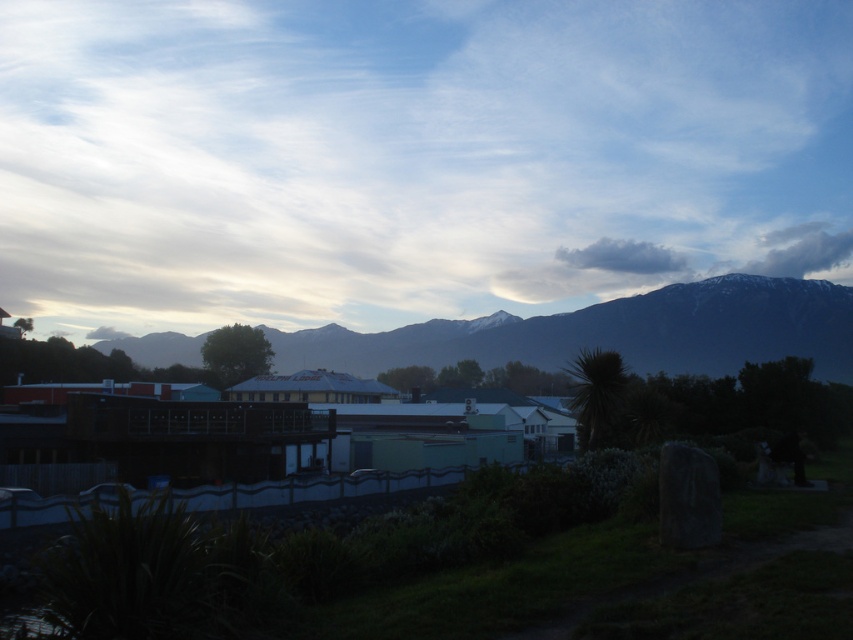
Can you confirm if snow-covered mountain range at upper center is thinner than gray fluffy cloud at upper center?

No.

Is point (282, 339) positioned behind point (612, 252)?

That is False.

Who is more forward, (431, 323) or (672, 257)?

Point (431, 323) is in front.

The image size is (853, 640). I want to click on snow-covered mountain range at upper center, so click(x=613, y=332).